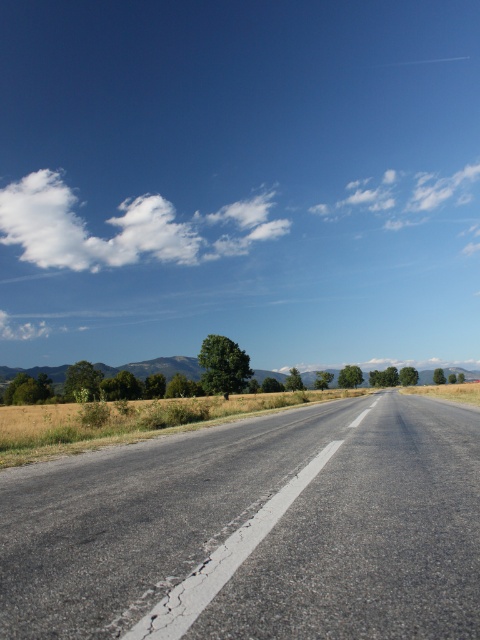
Which is more to the left, asphalt road at center or white fluffy cloud at upper left?

white fluffy cloud at upper left is more to the left.

Which of these two, asphalt road at center or white fluffy cloud at upper left, stands shorter?

With less height is asphalt road at center.

Who is more forward, (292,442) or (32,208)?

Point (292,442) is in front.

This screenshot has width=480, height=640. Identify the location of asphalt road at center. (254, 529).